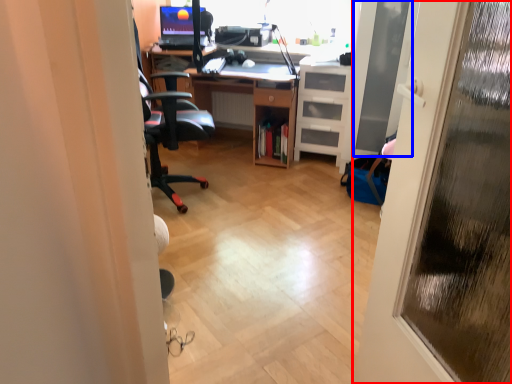
Question: Which object is closer to the camera taking this photo, door (highlighted by a red box) or screen door (highlighted by a blue box)?

Choices:
 (A) door
 (B) screen door

Answer: (A)